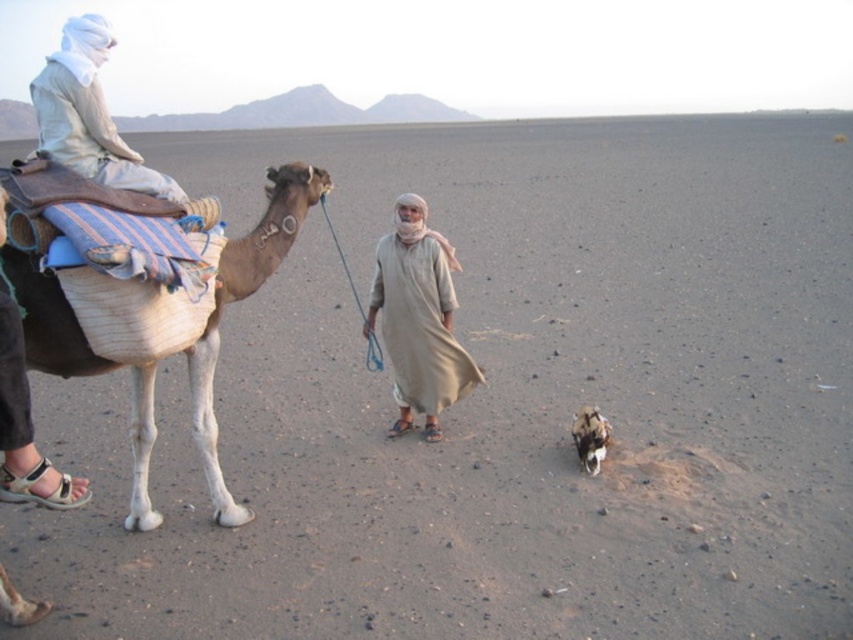
You are a traveler in the desert and see the beige cotton robe at center and the white cotton headscarf at upper left. Which clothing item is bigger in size?

The beige cotton robe at center is larger in size compared to the white cotton headscarf at upper left.

In the scene shown: You are a traveler in the desert and need to decide which item is taller between the white cotton headscarf at upper left and the spotted fur camel at lower right. Based on the scene, which one is taller?

The white cotton headscarf at upper left is taller than the spotted fur camel at lower right according to the description.

Where is the beige cotton robe at center located in the image?

The beige cotton robe at center is located at point coordinates of (418, 314).